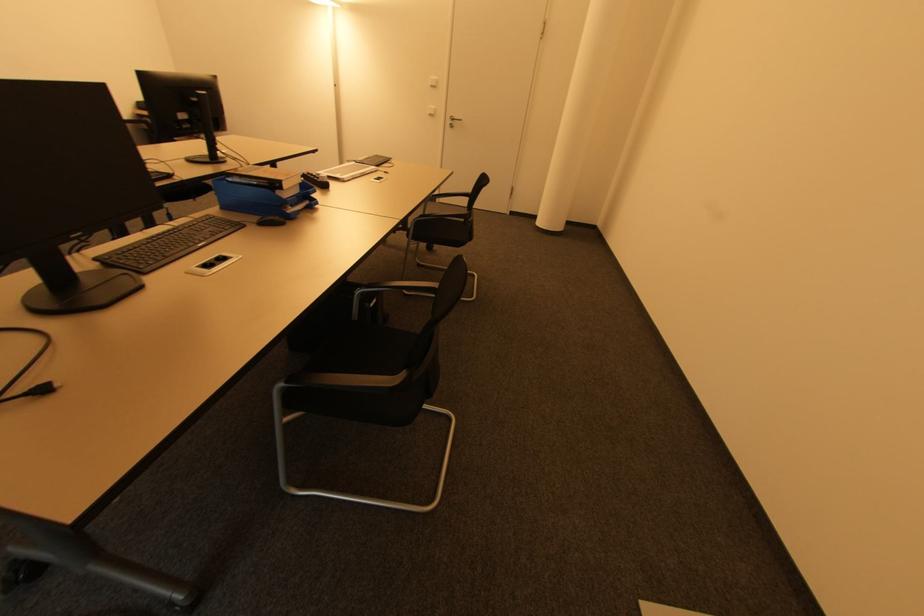
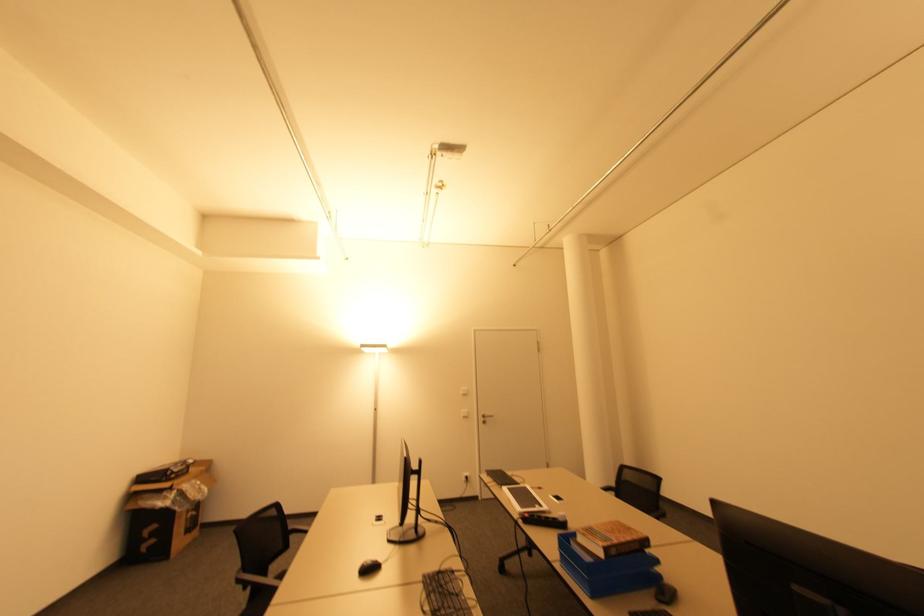
In the second image, find the point that corresponds to pixel 454 127 in the first image.

(485, 422)